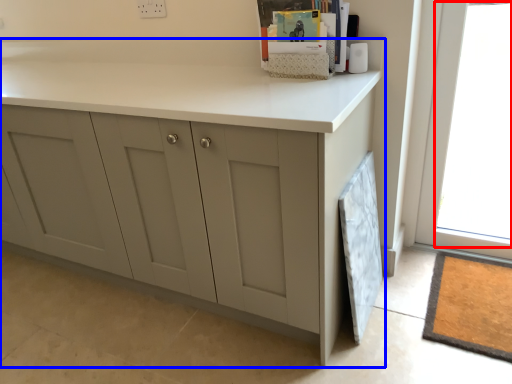
Question: Which object appears farthest to the camera in this image, window (highlighted by a red box) or cabinetry (highlighted by a blue box)?

Choices:
 (A) window
 (B) cabinetry

Answer: (A)